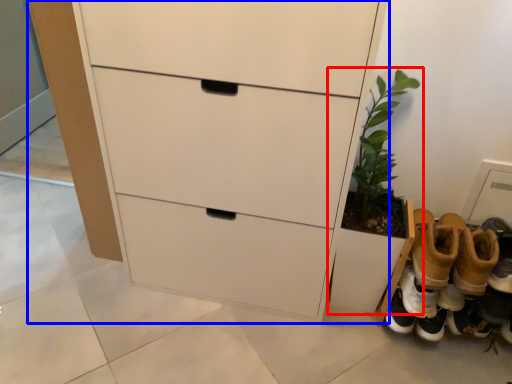
Question: Which of the following is the closest to the observer, houseplant (highlighted by a red box) or chest of drawers (highlighted by a blue box)?

Choices:
 (A) houseplant
 (B) chest of drawers

Answer: (B)